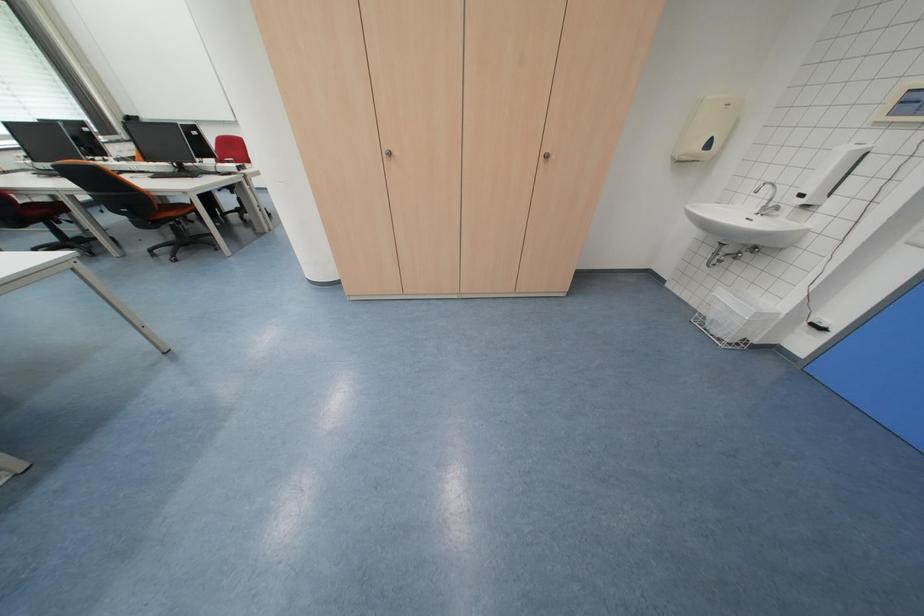
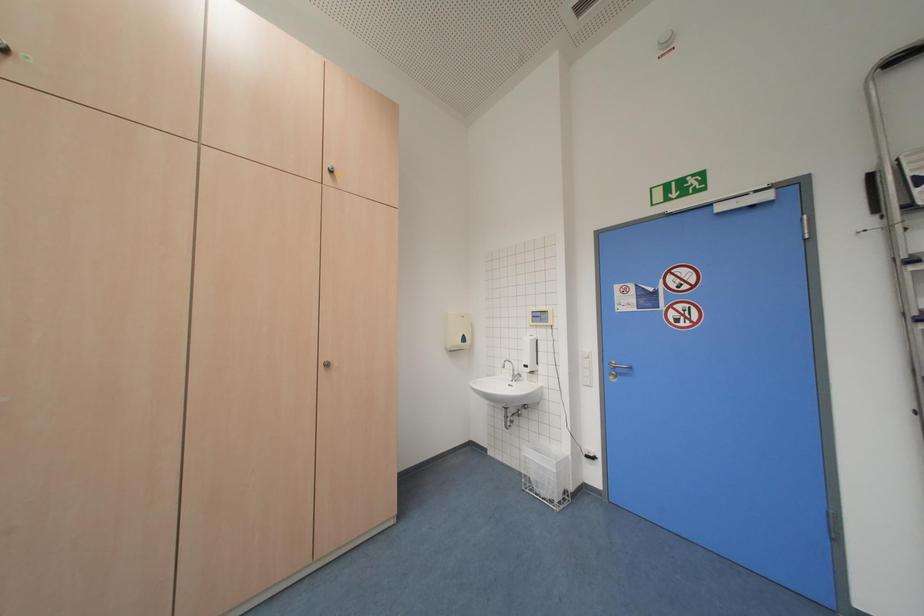
Based on the continuous images, in which direction is the camera rotating?

The camera's rotation is toward right-up.